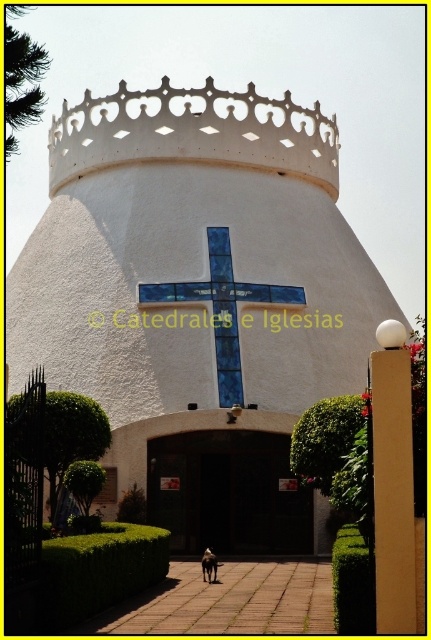
You are standing in front of the church entrance. You need to locate the dark brown wooden door at center to enter. Which direction should you look relative to the white textured dome at center?

The dark brown wooden door at center is located below the white textured dome at center, so you should look downward from the white textured dome at center to find it.

You are standing in front of the church and want to enter through the entrance. Which object, the white textured crown at upper center or the blue glass cross at center, is closer to the entrance?

The blue glass cross at center is closer to the entrance because the white textured crown at upper center is positioned over it, meaning the crown is above the cross and farther from the entrance.

You are standing at the entrance of the church and want to walk towards the point labeled as point (x=243, y=490). If you continue moving in the same direction, will you eventually reach point (x=293, y=262)?

Point (x=293, y=262) is behind point (x=243, y=490), so if you move forward from the entrance towards point (x=243, y=490), you will not reach point (x=293, y=262) as it is located behind your current position.